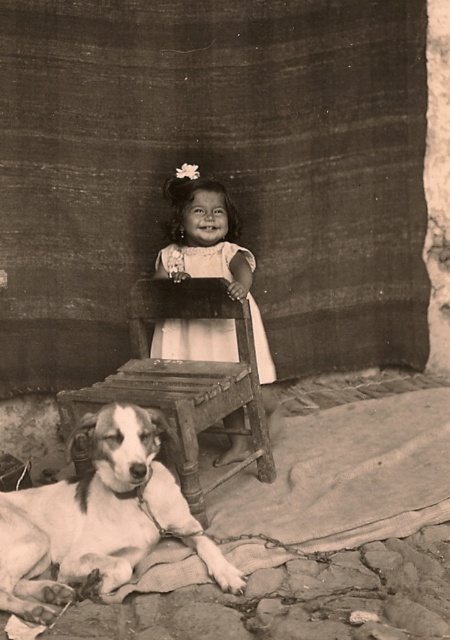
Question: Estimate the real-world distances between objects in this image. Which object is farther from the white cotton dress at center?

Choices:
 (A) white fur dog at lower left
 (B) wooden stool at lower left
 (C) white matte dress at center

Answer: (A)

Question: Among these points, which one is nearest to the camera?

Choices:
 (A) pyautogui.click(x=171, y=266)
 (B) pyautogui.click(x=220, y=376)
 (C) pyautogui.click(x=190, y=544)
 (D) pyautogui.click(x=269, y=372)

Answer: (C)

Question: From the image, what is the correct spatial relationship of white fur dog at lower left in relation to white cotton dress at center?

Choices:
 (A) above
 (B) below

Answer: (B)

Question: Is wooden stool at lower left closer to the viewer compared to white cotton dress at center?

Choices:
 (A) yes
 (B) no

Answer: (A)

Question: Which point is closer to the camera?

Choices:
 (A) (158, 401)
 (B) (98, 456)

Answer: (B)

Question: From the image, what is the correct spatial relationship of white matte dress at center in relation to wooden stool at lower left?

Choices:
 (A) below
 (B) above

Answer: (B)